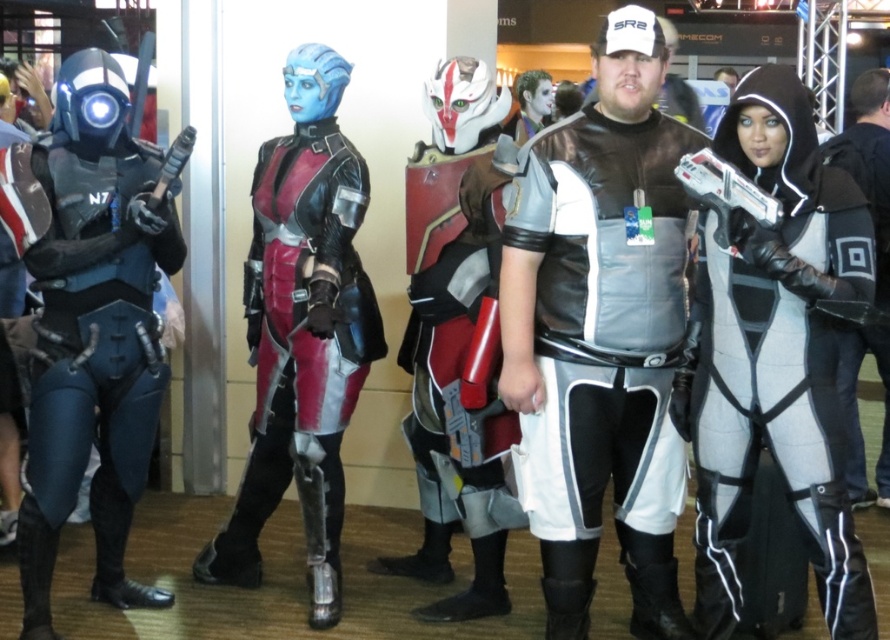
Question: Which point is closer to the camera?

Choices:
 (A) (411, 307)
 (B) (125, 182)

Answer: (B)

Question: Is silver metallic armor at center behind white matte bodysuit at center?

Choices:
 (A) no
 (B) yes

Answer: (B)

Question: Among these points, which one is farthest from the camera?

Choices:
 (A) (615, 273)
 (B) (886, 227)
 (C) (705, 636)
 (D) (490, 500)

Answer: (B)

Question: Is leather-like armor at center to the right of white matte jacket at center from the viewer's perspective?

Choices:
 (A) yes
 (B) no

Answer: (B)

Question: Does white matte bodysuit at center have a smaller size compared to leather-like armor at center?

Choices:
 (A) yes
 (B) no

Answer: (A)

Question: Among these points, which one is farthest from the camera?

Choices:
 (A) (876, 269)
 (B) (66, 468)
 (C) (587, 236)
 (D) (328, 307)

Answer: (A)